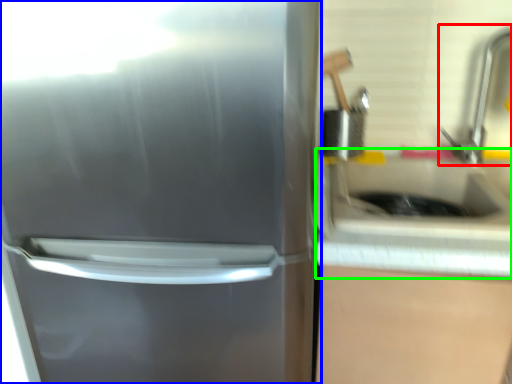
Question: Which object is positioned closest to faucet (highlighted by a red box)? Select from refrigerator (highlighted by a blue box) and counter top (highlighted by a green box).

Choices:
 (A) refrigerator
 (B) counter top

Answer: (B)